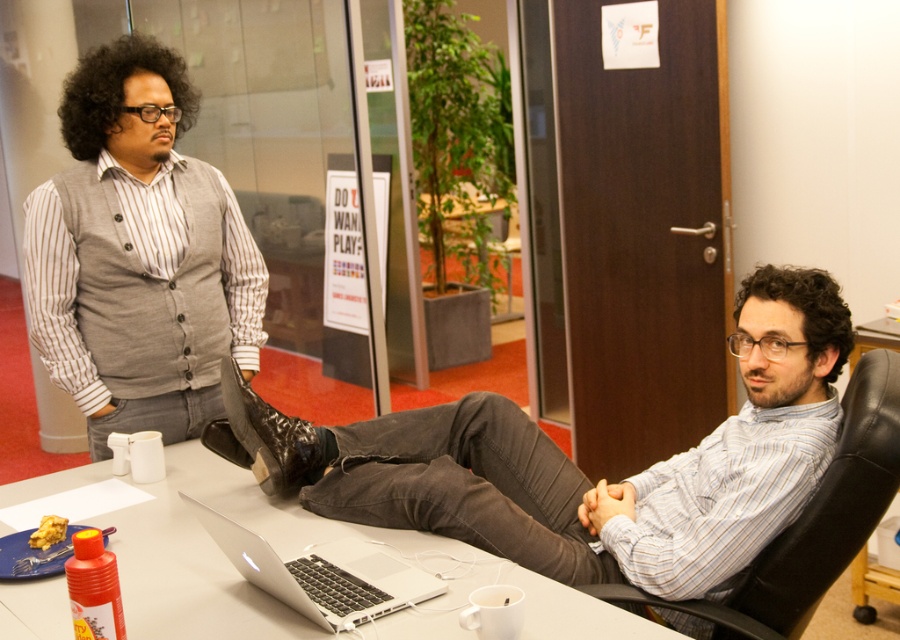
Question: Which object is closer to the camera taking this photo?

Choices:
 (A) shiny black boot at center
 (B) silver metallic laptop at center
 (C) white glossy table at center
 (D) matte black pants at center

Answer: (B)

Question: Which object is farther from the camera taking this photo?

Choices:
 (A) matte black pants at center
 (B) black leather swivel chair at center
 (C) silver metallic laptop at center

Answer: (A)

Question: Can you confirm if matte gray vest at left is positioned above shiny black boot at center?

Choices:
 (A) yes
 (B) no

Answer: (A)

Question: Which point appears farthest from the camera in this image?

Choices:
 (A) (291, 576)
 (B) (544, 624)
 (C) (855, 432)
 (D) (28, 262)

Answer: (D)

Question: Is matte black pants at center below white glossy table at center?

Choices:
 (A) yes
 (B) no

Answer: (B)

Question: Can you confirm if white glossy table at center is wider than silver metallic laptop at center?

Choices:
 (A) no
 (B) yes

Answer: (B)